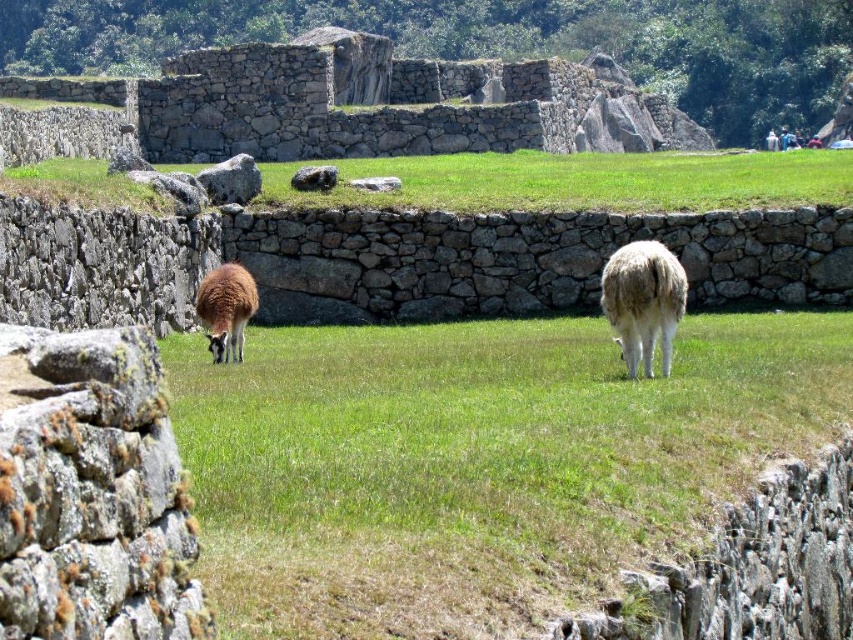
Question: Among these objects, which one is farthest from the camera?

Choices:
 (A) light blue fabric at upper right
 (B) green grassy field at center

Answer: (A)

Question: Can you confirm if brown woolly alpaca at left is positioned to the left of light blue fabric at upper right?

Choices:
 (A) no
 (B) yes

Answer: (B)

Question: Does fuzzy white llama at center have a larger size compared to brown woolly alpaca at left?

Choices:
 (A) yes
 (B) no

Answer: (A)

Question: Considering the relative positions of fuzzy white llama at center and white woolly sheep at center in the image provided, where is fuzzy white llama at center located with respect to white woolly sheep at center?

Choices:
 (A) right
 (B) left

Answer: (B)

Question: Estimate the real-world distances between objects in this image. Which object is farther from the brown woolly alpaca at left?

Choices:
 (A) fuzzy white llama at center
 (B) light blue fabric at upper right

Answer: (B)

Question: Among these objects, which one is farthest from the camera?

Choices:
 (A) brown woolly alpaca at left
 (B) light blue fabric at upper right

Answer: (B)